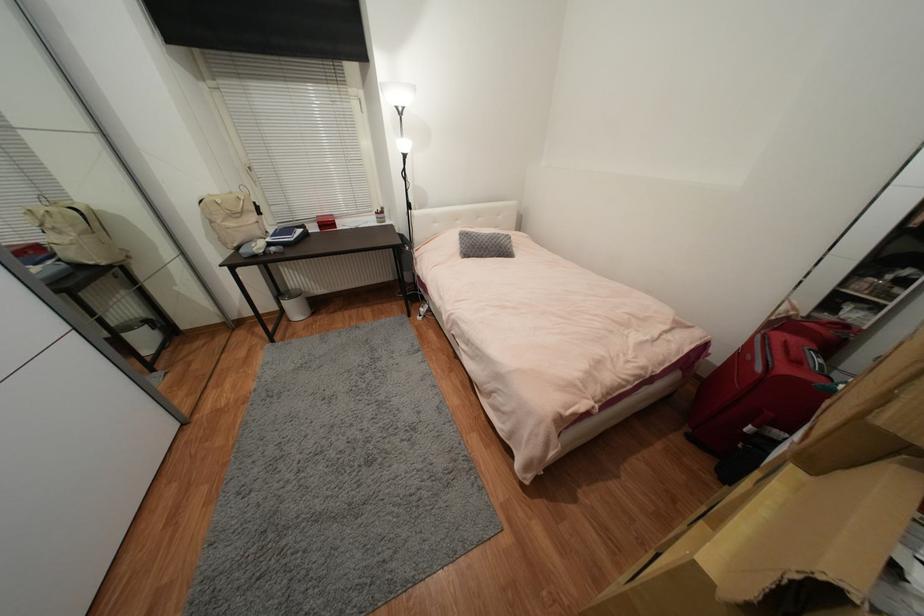
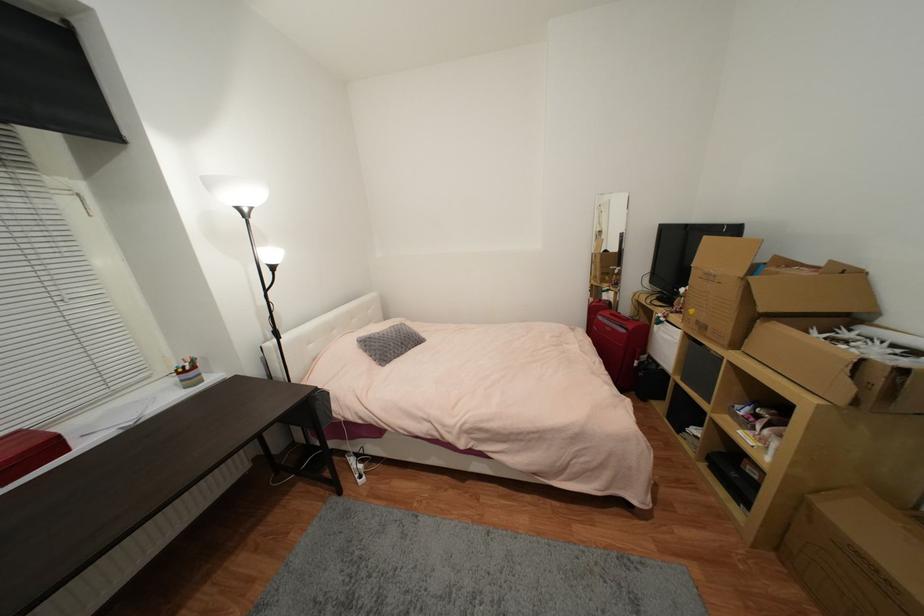
In the second image, find the point that corresponds to point (468, 232) in the first image.

(365, 338)